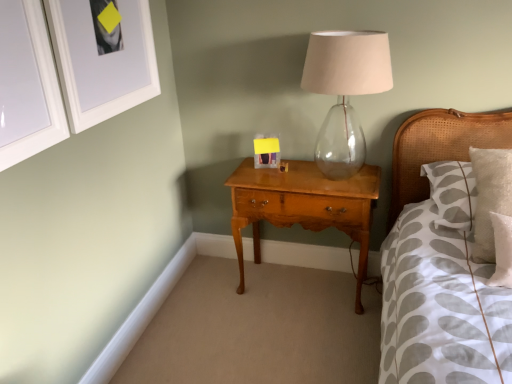
Image resolution: width=512 pixels, height=384 pixels. I want to click on vacant space underneath transparent glass table lamp at center (from a real-world perspective), so (x=345, y=177).